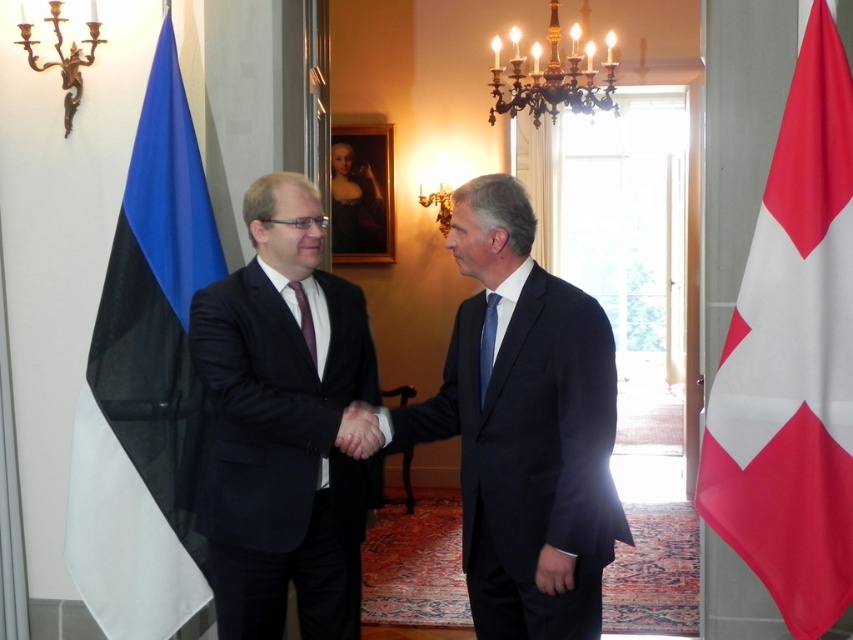
Is white fabric flag at right below blue silk tie at center?

No, white fabric flag at right is not below blue silk tie at center.

Does white fabric flag at right lie behind blue silk tie at center?

→ That is True.

What do you see at coordinates (792, 360) in the screenshot? This screenshot has height=640, width=853. I see `white fabric flag at right` at bounding box center [792, 360].

The height and width of the screenshot is (640, 853). Identify the location of white fabric flag at right. (792, 360).

Based on the photo, does dark blue suit at center have a lesser height compared to white fabric flag at right?

Indeed, dark blue suit at center has a lesser height compared to white fabric flag at right.

Is dark blue suit at center bigger than white fabric flag at right?

Correct, dark blue suit at center is larger in size than white fabric flag at right.

Which is in front, point (502, 458) or point (805, 499)?

Point (502, 458) is in front.

Locate an element on the screen. The width and height of the screenshot is (853, 640). dark blue suit at center is located at coordinates (524, 428).

Which is more to the right, matte black suit at center or purple satin tie at center?

Positioned to the right is purple satin tie at center.

Does matte black suit at center appear under purple satin tie at center?

Indeed, matte black suit at center is positioned under purple satin tie at center.

Who is more distant from viewer, (357,352) or (289,282)?

The point (357,352) is more distant.

The image size is (853, 640). I want to click on matte black suit at center, so click(x=283, y=426).